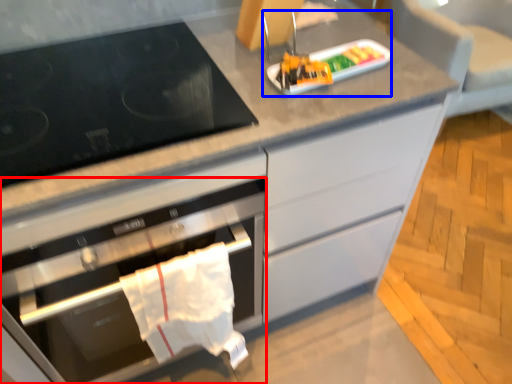
Question: Which object is further to the camera taking this photo, oven (highlighted by a red box) or appliance (highlighted by a blue box)?

Choices:
 (A) oven
 (B) appliance

Answer: (B)